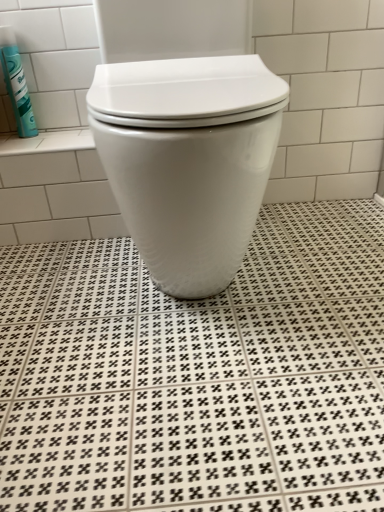
What do you see at coordinates (16, 83) in the screenshot? I see `teal glossy spray can at left` at bounding box center [16, 83].

You are a GUI agent. You are given a task and a screenshot of the screen. Output one action in this format:
    pyautogui.click(x=<x>, y=<y>)
    Task: Click on the teal glossy spray can at left
    
    Given the screenshot: What is the action you would take?
    pyautogui.click(x=16, y=83)

This screenshot has width=384, height=512. What are the coordinates of `teal glossy spray can at left` in the screenshot? It's located at (16, 83).